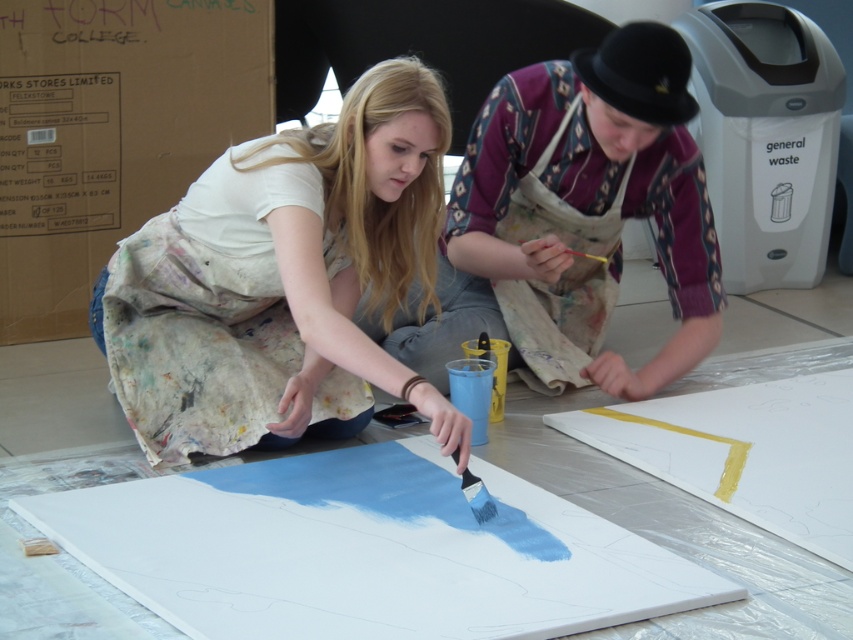
Can you confirm if matte white shirt at center is bigger than red wooden paint brush at center?

Yes.

Who is taller, matte white shirt at center or red wooden paint brush at center?

Standing taller between the two is matte white shirt at center.

The image size is (853, 640). In order to click on matte white shirt at center in this screenshot , I will do `click(277, 275)`.

Locate an element on the screen. The height and width of the screenshot is (640, 853). matte white shirt at center is located at coordinates (277, 275).